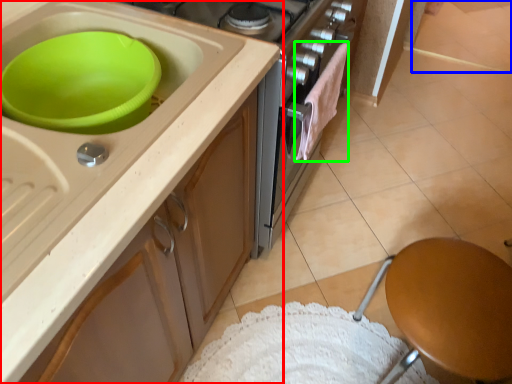
Question: Considering the real-world distances, which object is farthest from cabinetry (highlighted by a red box)? tile (highlighted by a blue box) or clothe (highlighted by a green box)?

Choices:
 (A) tile
 (B) clothe

Answer: (A)